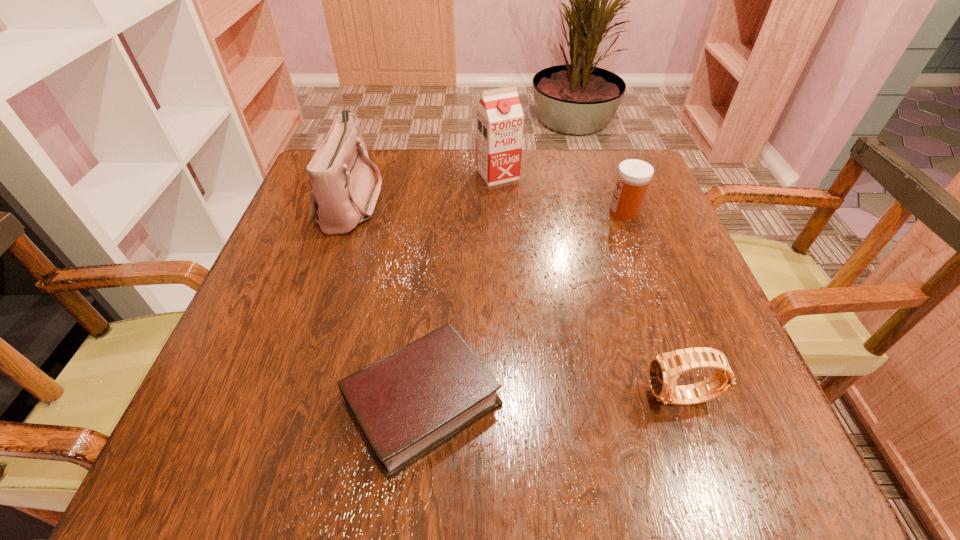
You are a GUI agent. You are given a task and a screenshot of the screen. Output one action in this format:
    pyautogui.click(x=<x>, y=<y>)
    Task: Click on the watch that is at the right edge
    Image resolution: width=960 pixels, height=540 pixels.
    Given the screenshot: What is the action you would take?
    pyautogui.click(x=664, y=369)

The height and width of the screenshot is (540, 960). I want to click on object at the far left corner, so click(343, 194).

At what (x,y) coordinates should I click in order to perform the action: click on object present at the far right corner. Please return your answer as a coordinate pair (x, y). The height and width of the screenshot is (540, 960). Looking at the image, I should click on (634, 175).

Find the location of a particular element. object positioned at the near right corner is located at coordinates (664, 369).

Find the location of `free space at the far edge of the desktop`. free space at the far edge of the desktop is located at coordinates (412, 189).

This screenshot has width=960, height=540. I want to click on vacant space at the near edge of the desktop, so click(x=492, y=465).

I want to click on vacant space at the left edge of the desktop, so click(x=248, y=322).

Identify the location of vacant space at the right edge of the desktop. (637, 298).

I want to click on vacant area at the near left corner of the desktop, so click(279, 445).

Locate an element on the screen. vacant point at the far right corner is located at coordinates (605, 154).